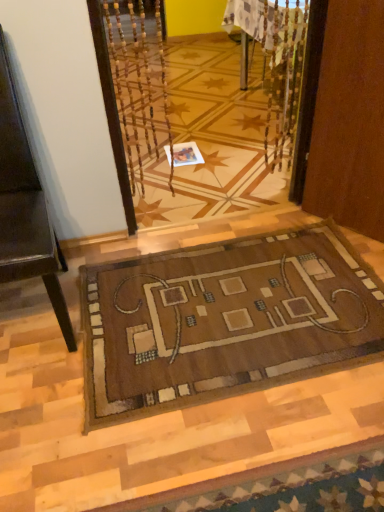
What do you see at coordinates (186, 154) in the screenshot?
I see `white paper at center` at bounding box center [186, 154].

At what (x,y) coordinates should I click in order to perform the action: click on white paper at center. Please return your answer as a coordinate pair (x, y). Image resolution: width=384 pixels, height=512 pixels. Looking at the image, I should click on (x=186, y=154).

In terms of height, does brown woven mat at center look taller or shorter compared to white paper at center?

In the image, brown woven mat at center appears to be shorter than white paper at center.

The width and height of the screenshot is (384, 512). I want to click on mat below the white paper at center (from the image's perspective), so click(225, 320).

From a real-world perspective, is brown woven mat at center positioned above or below white paper at center?

In terms of real-world spatial position, brown woven mat at center is above white paper at center.

Is brown woven mat at center far from white paper at center?

Yes, brown woven mat at center and white paper at center are located far from each other.

From a real-world perspective, between brown leather chair at left and brown woven mat at center, who is vertically lower?

brown woven mat at center.

In the image, there is a brown woven mat at center. Identify the location of furniture above it (from the image's perspective). The width and height of the screenshot is (384, 512). (26, 208).

Would you say brown leather chair at left is to the left or to the right of brown woven mat at center in the picture?

Based on their positions, brown leather chair at left is located to the left of brown woven mat at center.

Which object is wider, brown leather chair at left or brown woven mat at center?

brown woven mat at center is wider.

Is brown woven mat at center a part of white paper at center?

Actually, brown woven mat at center is outside white paper at center.

How many degrees apart are the facing directions of white paper at center and brown woven mat at center?

The angular difference between white paper at center and brown woven mat at center is 2.14 degrees.

From the image's perspective, which object appears higher, white paper at center or brown woven mat at center?

white paper at center.

Based on the photo, in terms of size, does white paper at center appear bigger or smaller than brown leather chair at left?

In the image, white paper at center appears to be smaller than brown leather chair at left.

From a real-world perspective, which object stands above the other?

In real-world perspective, brown leather chair at left is above.

Is white paper at center completely or partially outside of brown leather chair at left?

white paper at center lies outside brown leather chair at left's area.

Based on the photo, from the image's perspective, which is below, white paper at center or brown leather chair at left?

brown leather chair at left is shown below in the image.

From the image's perspective, who appears lower, brown woven mat at center or brown leather chair at left?

From the image's view, brown woven mat at center is below.

Are brown woven mat at center and brown leather chair at left far apart?

Actually, brown woven mat at center and brown leather chair at left are a little close together.

Does brown woven mat at center have a lesser height compared to brown leather chair at left?

Yes, brown woven mat at center is shorter than brown leather chair at left.

Between brown leather chair at left and white paper at center, which one appears on the left side from the viewer's perspective?

brown leather chair at left is more to the left.

Is brown leather chair at left not close to white paper at center?

brown leather chair at left is positioned a significant distance from white paper at center.

Image resolution: width=384 pixels, height=512 pixels. Identify the location of furniture above the white paper at center (from a real-world perspective). (26, 208).

How different are the orientations of brown leather chair at left and white paper at center in degrees?

4.71 degrees separate the facing orientations of brown leather chair at left and white paper at center.

Locate an element on the screen. The image size is (384, 512). mat on the right of white paper at center is located at coordinates (225, 320).

Locate an element on the screen. The width and height of the screenshot is (384, 512). mat that is under the brown leather chair at left (from a real-world perspective) is located at coordinates (225, 320).

Based on their spatial positions, is white paper at center or brown leather chair at left closer to brown woven mat at center?

brown leather chair at left.

Which object lies further to the anchor point brown leather chair at left, white paper at center or brown woven mat at center?

white paper at center lies further to brown leather chair at left than the other object.

From the picture: Considering their positions, is brown woven mat at center positioned further to white paper at center than brown leather chair at left?

Among the two, brown leather chair at left is located further to white paper at center.

When comparing their distances from brown leather chair at left, does brown woven mat at center or white paper at center seem closer?

brown woven mat at center is positioned closer to the anchor brown leather chair at left.

From the image, which object appears to be nearer to white paper at center, brown leather chair at left or brown woven mat at center?

The object closer to white paper at center is brown woven mat at center.

From the image, which object appears to be nearer to brown woven mat at center, brown leather chair at left or white paper at center?

brown leather chair at left lies closer to brown woven mat at center than the other object.

The image size is (384, 512). Find the location of `mat between brown leather chair at left and white paper at center along the z-axis`. mat between brown leather chair at left and white paper at center along the z-axis is located at coordinates (225, 320).